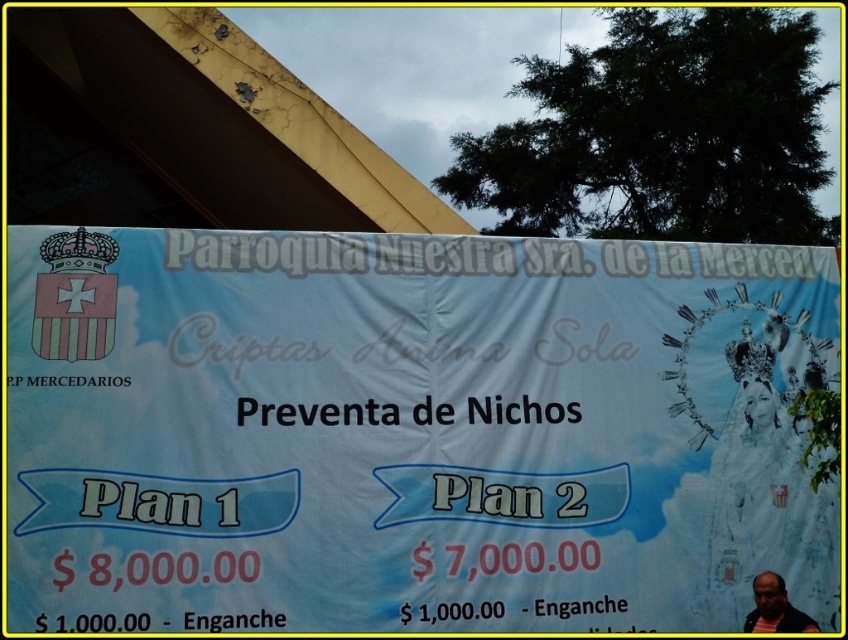
You are an event organizer at the Parroquia Nuestra Sra. de la Merced. You need to determine if there is enough space on the banner to add an additional section for event details. Based on the image, does the white paper banner at center have enough space compared to the striped shirt at lower right?

The white paper banner at center occupies less space than striped shirt at lower right, so there might be sufficient space remaining on the banner to add more details without overlapping the striped shirt at lower right.

Consider the image. You are standing in front of the banner at the Parroquia Nuestra Sra. de la Merced. You notice a white paper banner at center and a striped shirt at lower right. Which object is taller?

The white paper banner at center is much taller than the striped shirt at lower right.

You are standing in front of the banner at the entrance of the church. You see a white paper banner at center and a striped shirt at lower right. Which object is closer to you?

The white paper banner at center is closer to you because the striped shirt at lower right is behind it.